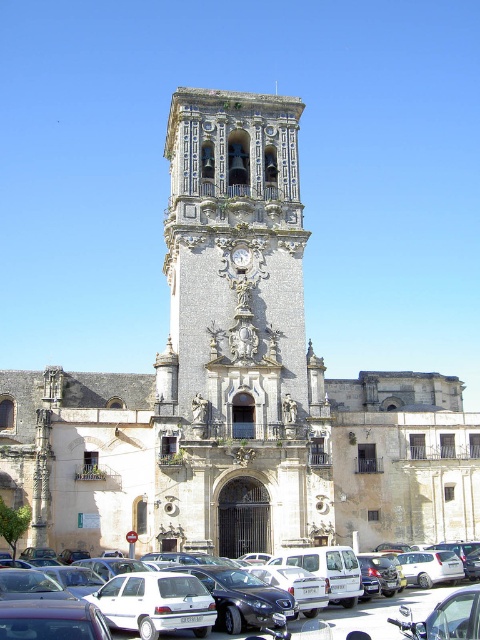
Which is more to the right, stone ornate tower at center or white matte cars at lower center?

Positioned to the right is white matte cars at lower center.

This screenshot has width=480, height=640. Identify the location of stone ornate tower at center. (238, 337).

Looking at this image, is beige stone church at center smaller than white matte cars at lower center?

No.

Which is more to the left, beige stone church at center or white matte cars at lower center?

Positioned to the left is white matte cars at lower center.

Does point (283, 461) come farther from viewer compared to point (187, 566)?

That is True.

Locate an element on the screen. This screenshot has height=640, width=480. beige stone church at center is located at coordinates (238, 387).

Does white matte cars at lower center have a lesser height compared to gold textured clock at center?

Incorrect, white matte cars at lower center's height does not fall short of gold textured clock at center's.

Who is higher up, white matte cars at lower center or gold textured clock at center?

gold textured clock at center is higher up.

Between point (358, 621) and point (233, 262), which one is positioned in front?

Point (358, 621) is more forward.

Locate an element on the screen. Image resolution: width=480 pixels, height=640 pixels. white matte cars at lower center is located at coordinates (384, 611).